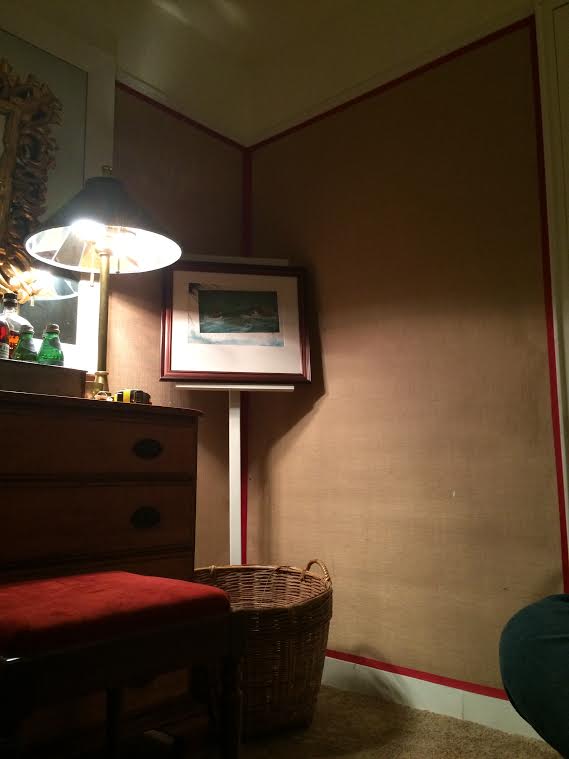
Where is `white floor molding`? Image resolution: width=569 pixels, height=759 pixels. white floor molding is located at coordinates (452, 704).